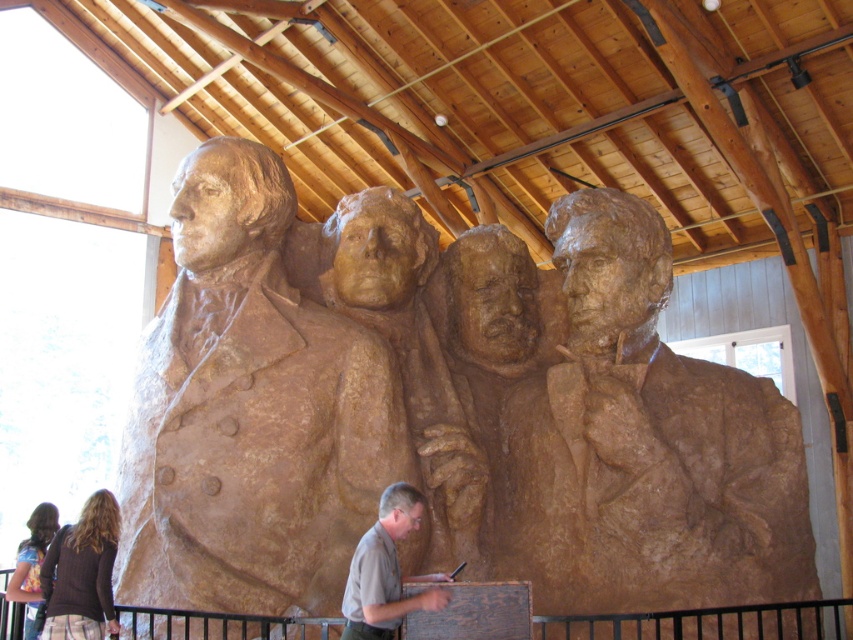
Does brown textured bust at right come behind brown textured sculpture at center?

That is False.

Who is more forward, (785, 488) or (438, 348)?

Point (785, 488) is in front.

You are a GUI agent. You are given a task and a screenshot of the screen. Output one action in this format:
    pyautogui.click(x=<x>, y=<y>)
    Task: Click on the brown textured bust at right
    The width and height of the screenshot is (853, 640).
    Given the screenshot: What is the action you would take?
    pyautogui.click(x=646, y=444)

Who is lower down, brown textured sculpture at left or brown textured sculpture at center?

brown textured sculpture at center

Does point (315, 612) come farther from viewer compared to point (439, 374)?

That is False.

The image size is (853, 640). Identify the location of brown textured sculpture at left. (250, 410).

Who is more distant from viewer, (433, 497) or (80, 515)?

The point (433, 497) is more distant.

Is point (286, 244) behind point (100, 497)?

Yes, it is.

From the picture: Who is more forward, (312, 260) or (79, 524)?

Positioned in front is point (79, 524).

Locate an element on the screen. The width and height of the screenshot is (853, 640). brown textured sculpture at center is located at coordinates (399, 344).